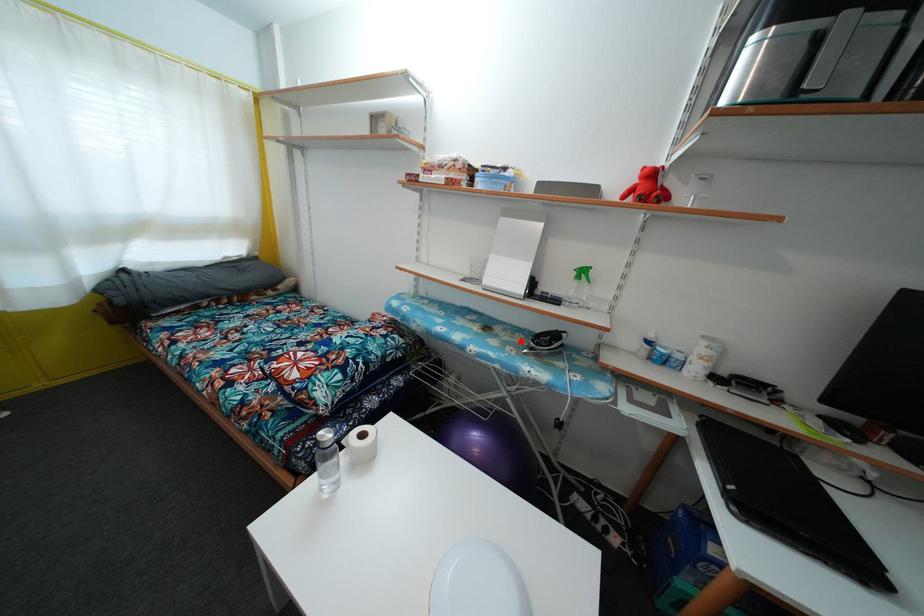
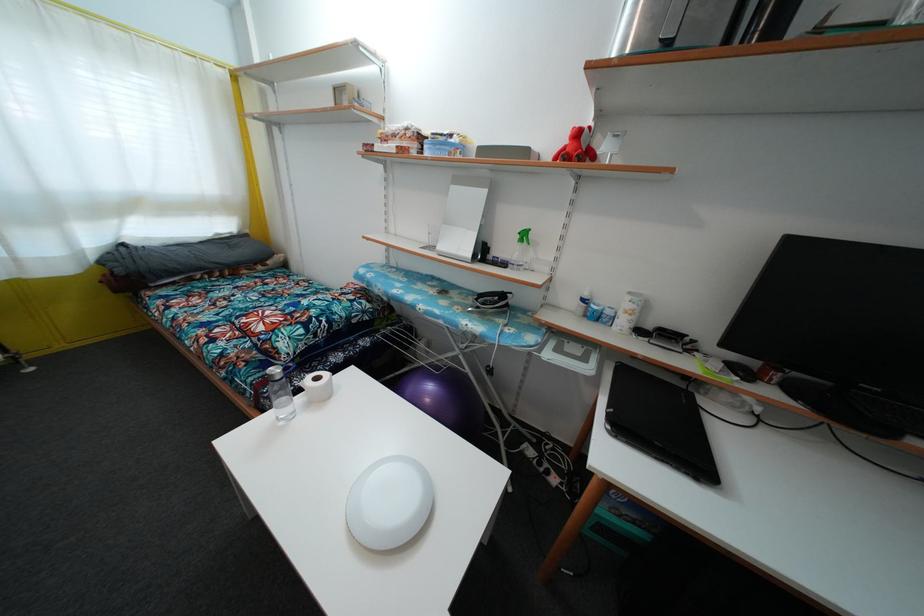
Where in the second image is the point corresponding to the highlighted location from the first image?

(475, 304)